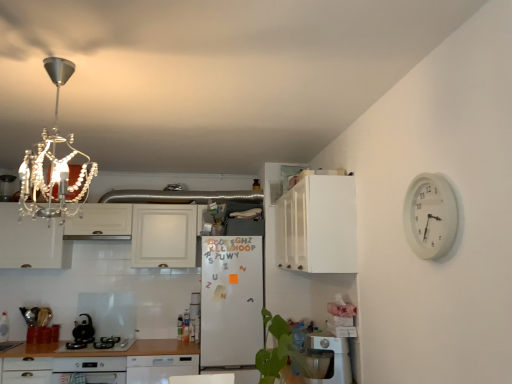
Question: From a real-world perspective, is white matte refrigerator at center positioned over black matte kettle at lower left based on gravity?

Choices:
 (A) no
 (B) yes

Answer: (B)

Question: Does white matte refrigerator at center contain black matte kettle at lower left?

Choices:
 (A) yes
 (B) no

Answer: (B)

Question: Does white matte refrigerator at center appear on the left side of black matte kettle at lower left?

Choices:
 (A) no
 (B) yes

Answer: (A)

Question: Is the position of white matte refrigerator at center more distant than that of black matte kettle at lower left?

Choices:
 (A) yes
 (B) no

Answer: (B)

Question: Can you confirm if white matte refrigerator at center is shorter than black matte kettle at lower left?

Choices:
 (A) yes
 (B) no

Answer: (B)

Question: Considering the relative sizes of white matte refrigerator at center and black matte kettle at lower left in the image provided, is white matte refrigerator at center thinner than black matte kettle at lower left?

Choices:
 (A) yes
 (B) no

Answer: (B)

Question: Can you confirm if white matte refrigerator at center is wider than black glass cooktop at lower left?

Choices:
 (A) no
 (B) yes

Answer: (B)

Question: From a real-world perspective, is white matte refrigerator at center positioned over black glass cooktop at lower left based on gravity?

Choices:
 (A) yes
 (B) no

Answer: (A)

Question: Is white matte refrigerator at center looking in the opposite direction of black glass cooktop at lower left?

Choices:
 (A) no
 (B) yes

Answer: (A)

Question: From a real-world perspective, is white matte refrigerator at center under black glass cooktop at lower left?

Choices:
 (A) yes
 (B) no

Answer: (B)

Question: Is white matte refrigerator at center bigger than black glass cooktop at lower left?

Choices:
 (A) yes
 (B) no

Answer: (A)

Question: Can you confirm if white matte refrigerator at center is shorter than black glass cooktop at lower left?

Choices:
 (A) no
 (B) yes

Answer: (A)

Question: Is white plastic dish washer at lower center, arranged as the first dish washer when viewed from the top, closer to camera compared to white matte cabinet at upper center, arranged as the 1th cabinetry when viewed from the right?

Choices:
 (A) yes
 (B) no

Answer: (A)